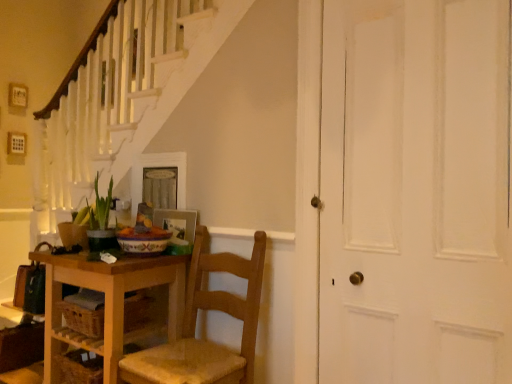
Question: From the image's perspective, relative to wooden table at lower left, is wooden picture frame at center, the 1th picture frame in the bottom-to-top sequence, above or below?

Choices:
 (A) below
 (B) above

Answer: (B)

Question: In the image, is wooden picture frame at center, the 1th picture frame in the bottom-to-top sequence, on the left side or the right side of wooden table at lower left?

Choices:
 (A) left
 (B) right

Answer: (B)

Question: Estimate the real-world distances between objects in this image. Which object is closer to the wooden picture frame at center, the 1th picture frame in the bottom-to-top sequence?

Choices:
 (A) wooden drawer at lower left
 (B) wooden table at lower left
 (C) wooden chair at center
 (D) wooden picture frame at lower left, the first picture frame positioned from the top
 (E) green leafy plant at lower left

Answer: (D)

Question: Considering the real-world distances, which object is farthest from the wooden table at lower left?

Choices:
 (A) green leafy plant at lower left
 (B) wooden picture frame at center, the 1th picture frame in the bottom-to-top sequence
 (C) wooden picture frame at lower left, acting as the 2th picture frame starting from the bottom
 (D) white matte door at right
 (E) wooden drawer at lower left

Answer: (D)